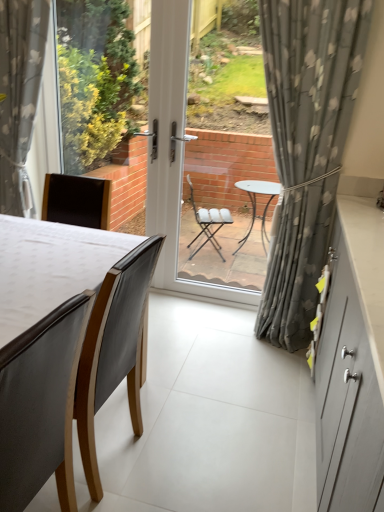
Where is `vacant space in between matte black chair at left, acting as the 2th chair starting from the front, and gray floral curtain at center, positioned as the first curtain in right-to-left order`? vacant space in between matte black chair at left, acting as the 2th chair starting from the front, and gray floral curtain at center, positioned as the first curtain in right-to-left order is located at coordinates (205, 386).